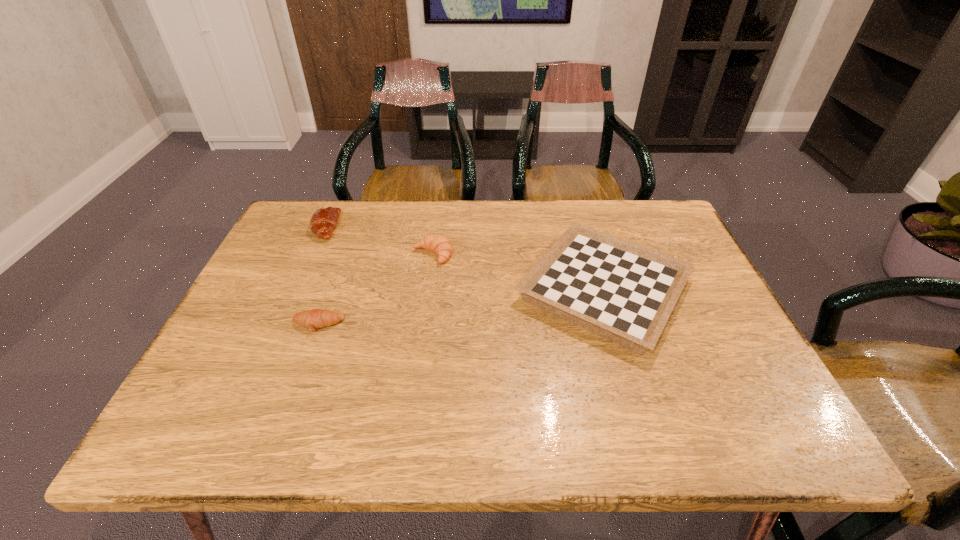
This screenshot has width=960, height=540. I want to click on object that is at the far right corner, so click(624, 292).

Locate an element on the screen. The width and height of the screenshot is (960, 540). free space at the far edge is located at coordinates (501, 207).

In the image, there is a desktop. At what (x,y) coordinates should I click in order to perform the action: click on vacant area at the near edge. Please return your answer as a coordinate pair (x, y). The image size is (960, 540). Looking at the image, I should click on (349, 448).

At what (x,y) coordinates should I click in order to perform the action: click on free region at the left edge of the desktop. Please return your answer as a coordinate pair (x, y). Looking at the image, I should click on (258, 279).

Where is `vacant space at the right edge of the desktop`? This screenshot has height=540, width=960. vacant space at the right edge of the desktop is located at coordinates (739, 338).

Locate an element on the screen. vacant space at the near left corner of the desktop is located at coordinates (210, 432).

In order to click on free space at the far right corner of the desktop in this screenshot , I will do `click(615, 207)`.

Locate an element on the screen. Image resolution: width=960 pixels, height=540 pixels. free spot between the shortest crescent roll and the rightmost object is located at coordinates (461, 307).

In order to click on vacant area that lies between the nearest crescent roll and the checkerboard in this screenshot , I will do `click(461, 307)`.

You are a GUI agent. You are given a task and a screenshot of the screen. Output one action in this format:
    pyautogui.click(x=<x>, y=<y>)
    Task: Click on the vacant area between the rightmost object and the nearest crescent roll
    The height and width of the screenshot is (540, 960).
    Given the screenshot: What is the action you would take?
    pyautogui.click(x=461, y=307)